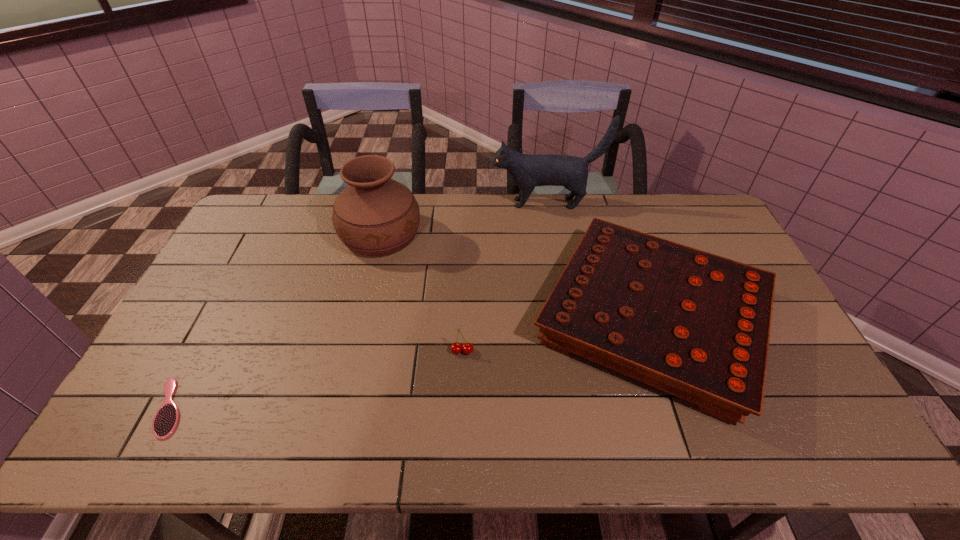
Find the location of a particular element. free location located at the face of the tallest object is located at coordinates (436, 203).

Find the location of a particular element. This screenshot has width=960, height=540. free space located 0.320m on the left of the urn is located at coordinates (248, 235).

The width and height of the screenshot is (960, 540). I want to click on blank space located 0.280m on the left of the gameboard, so click(432, 319).

Identify the location of vacant region located 0.120m with the stems of the cherry pointing upwards. Image resolution: width=960 pixels, height=540 pixels. (461, 397).

At what (x,y) coordinates should I click in order to perform the action: click on vacant space situated 0.220m on the back of the leftmost object. Please return your answer as a coordinate pair (x, y). Looking at the image, I should click on (220, 313).

Where is `cat that is at the far edge`? This screenshot has width=960, height=540. cat that is at the far edge is located at coordinates (527, 171).

Locate an element on the screen. The width and height of the screenshot is (960, 540). urn at the far edge is located at coordinates (374, 215).

At what (x,y) coordinates should I click in order to perform the action: click on gameboard located in the near edge section of the desktop. Please return your answer as a coordinate pair (x, y). Looking at the image, I should click on (696, 325).

Find the location of a particular element. This screenshot has width=960, height=540. hairbrush located at the near edge is located at coordinates (166, 419).

At what (x,y) coordinates should I click in order to perform the action: click on object that is at the left edge. Please return your answer as a coordinate pair (x, y). The width and height of the screenshot is (960, 540). Looking at the image, I should click on (166, 419).